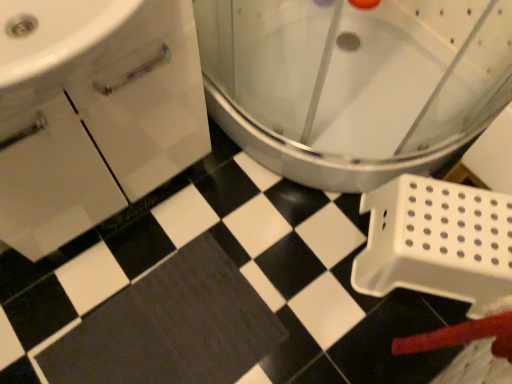
Where is `white plastic toilet at center`? white plastic toilet at center is located at coordinates (354, 82).

This screenshot has width=512, height=384. What do you see at coordinates (354, 82) in the screenshot?
I see `white plastic toilet at center` at bounding box center [354, 82].

Measure the distance between white plastic toilet at center and camera.

33.05 inches.

Describe the element at coordinates (170, 327) in the screenshot. I see `black matte bath mat at center` at that location.

In order to click on black matte bath mat at center in this screenshot , I will do `click(170, 327)`.

The height and width of the screenshot is (384, 512). In order to click on white plastic toilet at center in this screenshot , I will do `click(354, 82)`.

Considering the positions of objects black matte bath mat at center and white plastic toilet at center in the image provided, who is more to the left, black matte bath mat at center or white plastic toilet at center?

Positioned to the left is black matte bath mat at center.

Considering their positions, is black matte bath mat at center located in front of or behind white plastic toilet at center?

In the image, black matte bath mat at center appears behind white plastic toilet at center.

Which is in front, point (189, 259) or point (268, 118)?

Positioned in front is point (189, 259).

From the image's perspective, relative to white plastic toilet at center, is black matte bath mat at center above or below?

black matte bath mat at center is situated lower than white plastic toilet at center in the image.

From a real-world perspective, between black matte bath mat at center and white plastic toilet at center, who is vertically higher?

From a 3D spatial view, white plastic toilet at center is above.

Looking at their sizes, would you say black matte bath mat at center is wider or thinner than white plastic toilet at center?

Clearly, black matte bath mat at center has less width compared to white plastic toilet at center.

Considering the sizes of objects black matte bath mat at center and white plastic toilet at center in the image provided, who is shorter, black matte bath mat at center or white plastic toilet at center?

black matte bath mat at center.

Is black matte bath mat at center smaller than white plastic toilet at center?

Yes.

Is black matte bath mat at center inside or outside of white plastic toilet at center?

black matte bath mat at center is spatially situated outside white plastic toilet at center.

Is black matte bath mat at center placed right next to white plastic toilet at center?

black matte bath mat at center and white plastic toilet at center are clearly separated.

Is black matte bath mat at center facing towards white plastic toilet at center?

No, black matte bath mat at center is not aimed at white plastic toilet at center.

Can you tell me how much black matte bath mat at center and white plastic toilet at center differ in facing direction?

3.07 degrees.

In order to click on toilet above the black matte bath mat at center (from a real-world perspective) in this screenshot , I will do `click(354, 82)`.

Is white plastic toilet at center to the right of black matte bath mat at center from the viewer's perspective?

Correct, you'll find white plastic toilet at center to the right of black matte bath mat at center.

Considering the positions of objects white plastic toilet at center and black matte bath mat at center in the image provided, who is behind, white plastic toilet at center or black matte bath mat at center?

black matte bath mat at center is further from the camera.

Which is farther from the camera, (469, 138) or (252, 310)?

The point (469, 138) is farther.

From the image's perspective, relative to black matte bath mat at center, is white plastic toilet at center above or below?

white plastic toilet at center is situated higher than black matte bath mat at center in the image.

From a real-world perspective, is white plastic toilet at center above or below black matte bath mat at center?

In terms of real-world spatial position, white plastic toilet at center is above black matte bath mat at center.

Is white plastic toilet at center wider than black matte bath mat at center?

Correct, the width of white plastic toilet at center exceeds that of black matte bath mat at center.

From their relative heights in the image, would you say white plastic toilet at center is taller or shorter than black matte bath mat at center?

Considering their sizes, white plastic toilet at center has more height than black matte bath mat at center.

Consider the image. In terms of size, does white plastic toilet at center appear bigger or smaller than black matte bath mat at center?

white plastic toilet at center is bigger than black matte bath mat at center.

Do you think white plastic toilet at center is within black matte bath mat at center, or outside of it?

white plastic toilet at center is not inside black matte bath mat at center, it's outside.

Consider the image. Is white plastic toilet at center beside black matte bath mat at center?

white plastic toilet at center and black matte bath mat at center are clearly separated.

Is white plastic toilet at center facing away from black matte bath mat at center?

white plastic toilet at center is not turned away from black matte bath mat at center.

What's the angular difference between white plastic toilet at center and black matte bath mat at center's facing directions?

The facing directions of white plastic toilet at center and black matte bath mat at center are 3.07 degrees apart.

Where is `bath mat directly beneath the white plastic toilet at center (from a real-world perspective)`? bath mat directly beneath the white plastic toilet at center (from a real-world perspective) is located at coordinates (170, 327).

Identify the location of toilet in front of the black matte bath mat at center. (354, 82).

Find the location of a particular element. The width and height of the screenshot is (512, 384). toilet lying above the black matte bath mat at center (from the image's perspective) is located at coordinates (354, 82).